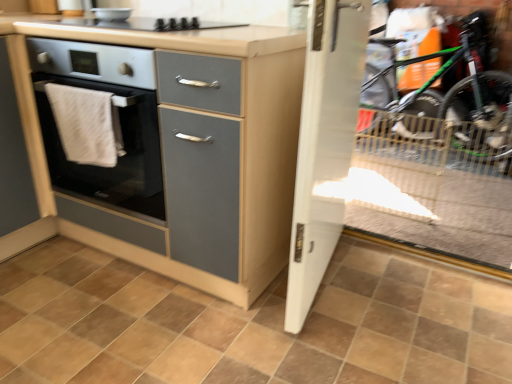
The image size is (512, 384). I want to click on vacant space in front of white glossy door at center, so click(340, 346).